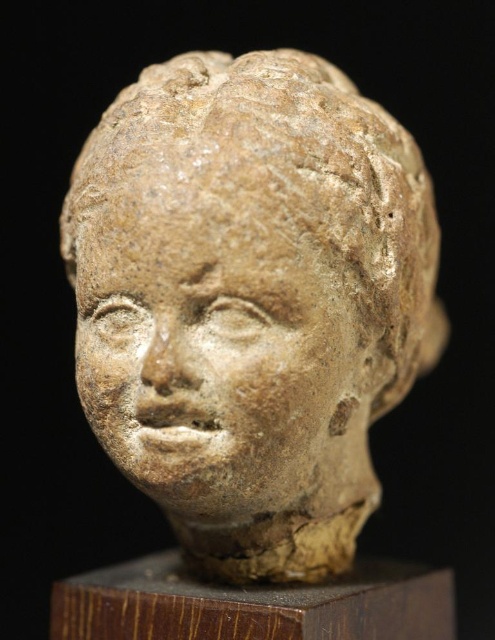
You are an archaeologist examining the stone sculpture. You notice two clay features at the center. Which one is closer to you, the brown clay head at center or the earthy clay face at center?

The brown clay head at center is closer to you because it is in front of the earthy clay face at center.

You are an archaeologist examining the stone sculpture. You notice two parts of the sculpture labeled as brown clay head at center and earthy clay face at center. Which part has a greater width?

The brown clay head at center might be wider than earthy clay face at center according to the description.

You are an archaeologist examining a stone sculpture. The sculpture is a brown clay head at center. Based on its location coordinates, can you determine if the head is positioned exactly in the center of the image?

The 2D location of brown clay head at center is at point (250, 301), which is very close to the center coordinates of (247, 320). Therefore, the head is positioned almost exactly in the center of the image.